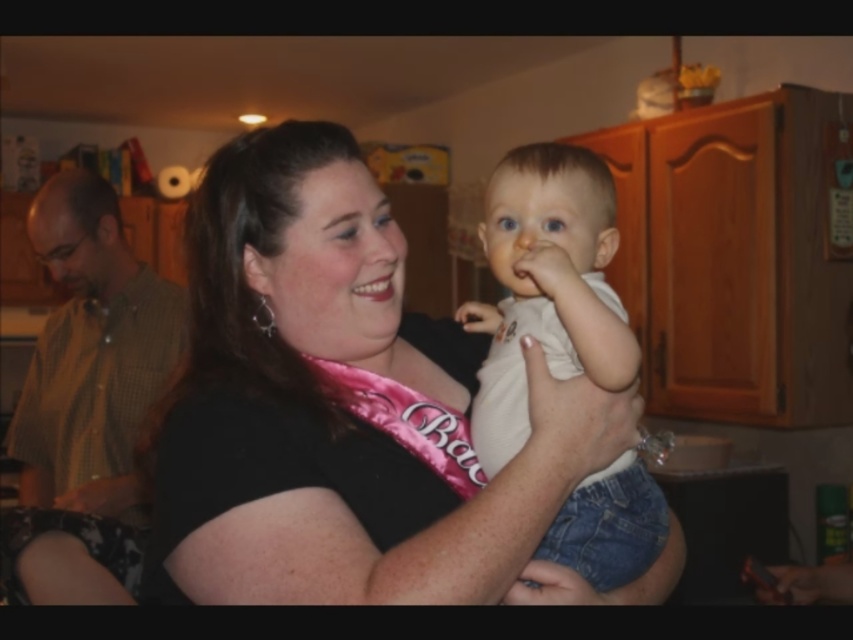
Is black satin sash at center below green checkered shirt at left?

No.

Is black satin sash at center to the right of green checkered shirt at left from the viewer's perspective?

Correct, you'll find black satin sash at center to the right of green checkered shirt at left.

Which is in front, point (146, 442) or point (83, 244)?

Positioned in front is point (146, 442).

This screenshot has width=853, height=640. In order to click on black satin sash at center in this screenshot , I will do `click(335, 404)`.

Does black satin sash at center have a greater width compared to white cotton shirt at center?

Yes, black satin sash at center is wider than white cotton shirt at center.

Which is in front, point (334, 282) or point (606, 376)?

Positioned in front is point (606, 376).

This screenshot has width=853, height=640. What do you see at coordinates (335, 404) in the screenshot?
I see `black satin sash at center` at bounding box center [335, 404].

Identify the location of black satin sash at center. (335, 404).

Measure the distance between green checkered shirt at left and white cotton shirt at center.

green checkered shirt at left and white cotton shirt at center are 1.20 meters apart from each other.

Which is above, green checkered shirt at left or white cotton shirt at center?

white cotton shirt at center is higher up.

Identify the location of green checkered shirt at left. This screenshot has width=853, height=640. click(x=85, y=403).

The width and height of the screenshot is (853, 640). What are the coordinates of `green checkered shirt at left` in the screenshot? It's located at (85, 403).